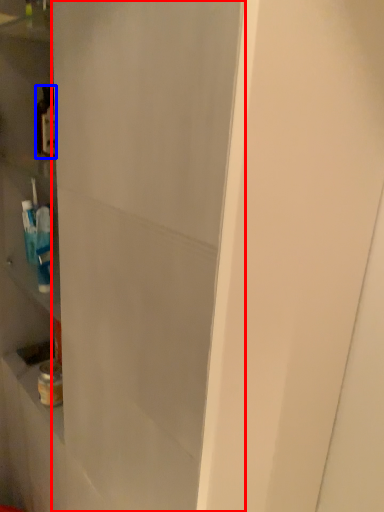
Question: Which object appears closest to the camera in this image, glass door (highlighted by a red box) or bottle (highlighted by a blue box)?

Choices:
 (A) glass door
 (B) bottle

Answer: (A)